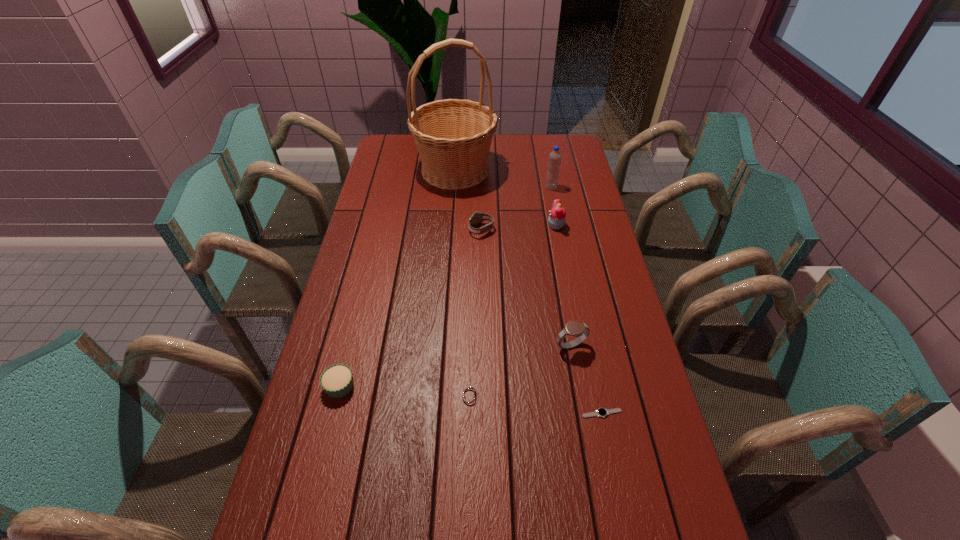
The image size is (960, 540). Find the location of `the second shortest object`. the second shortest object is located at coordinates (469, 395).

Locate an element on the screen. The image size is (960, 540). the shortest object is located at coordinates (601, 412).

Locate an element on the screen. The width and height of the screenshot is (960, 540). vacant space located 0.150m on the front of the tallest object is located at coordinates (451, 219).

Image resolution: width=960 pixels, height=540 pixels. I want to click on free space located on the left of the water bottle, so pos(475,187).

This screenshot has height=540, width=960. I want to click on free space located on the face of the right cupcake, so click(443, 226).

Locate an element on the screen. vacant position located 0.050m on the face of the right cupcake is located at coordinates (534, 226).

I want to click on vacant space located on the face of the right cupcake, so click(x=478, y=226).

You are a GUI agent. You are given a task and a screenshot of the screen. Output one action in this format:
    pyautogui.click(x=<x>, y=<y>)
    Task: Click on the blank area located on the left of the third nearest watch
    
    Given the screenshot: What is the action you would take?
    pyautogui.click(x=450, y=347)

Where is `blank space located on the face of the third shortest watch`? The image size is (960, 540). blank space located on the face of the third shortest watch is located at coordinates (444, 230).

The width and height of the screenshot is (960, 540). Identify the location of free spot located 0.400m on the face of the third shortest watch. (357, 230).